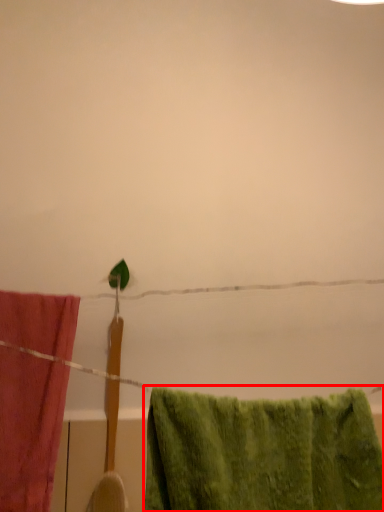
Question: From the image's perspective, considering the relative positions of towel (annotated by the red box) and towel in the image provided, where is towel (annotated by the red box) located with respect to the staircase?

Choices:
 (A) below
 (B) above

Answer: (A)